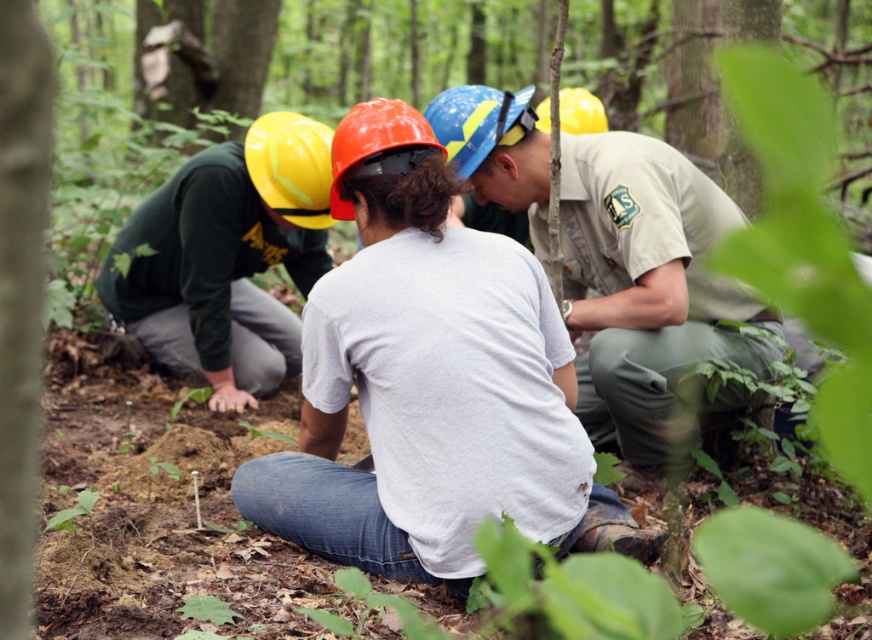
You are part of the forest conservation team and need to place a new sign between the smooth bark tree at left and the orange matte helmet at center. Based on their positions, where should the sign be placed?

The smooth bark tree at left is to the left of the orange matte helmet at center, so the sign should be placed between them, to the right of the smooth bark tree at left and to the left of the orange matte helmet at center.

You are a photographer trying to capture a clear shot of the white matte shirt at center and the khaki uniform at center in the forest scene. Since you want both subjects to be visible, which one should you focus on first to ensure the other remains in focus without adjusting the camera settings?

The white matte shirt at center occupies less space than the khaki uniform at center, so you should focus on the khaki uniform at center first. This is because focusing on the larger subject increases the likelihood that the smaller one will stay in focus without needing to adjust the camera settings.

You are a park ranger who needs to place a 1.2 meter long safety barrier between the smooth bark tree at left and the orange matte helmet at center. Is there enough space to place it without moving either object?

The distance between the smooth bark tree at left and the orange matte helmet at center is 1.03 meters, which is shorter than the 1.2 meter barrier. Therefore, there is not enough space to place it without moving either object.